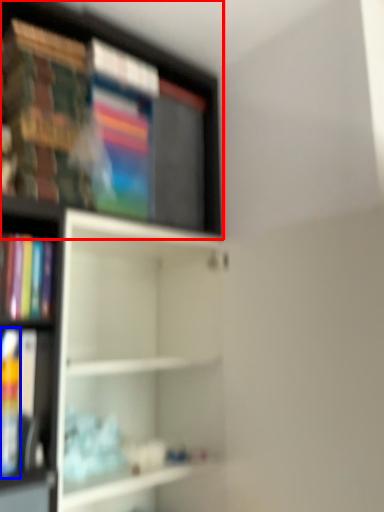
Question: Which object is closer to the camera taking this photo, shelf (highlighted by a red box) or book (highlighted by a blue box)?

Choices:
 (A) shelf
 (B) book

Answer: (B)